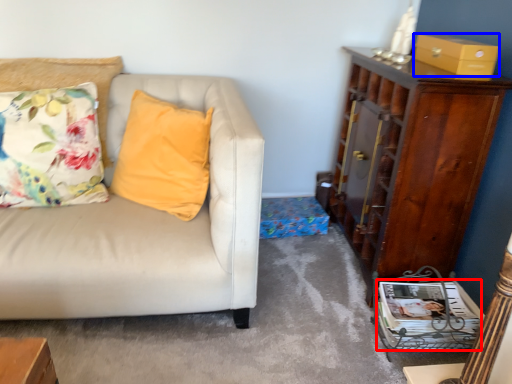
Question: Which of the following is the farthest to the observer, magazine (highlighted by a red box) or box (highlighted by a blue box)?

Choices:
 (A) magazine
 (B) box

Answer: (A)